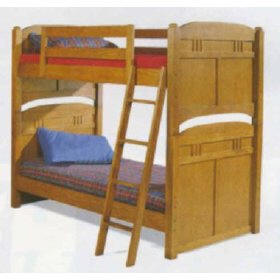
At what (x,y) coordinates should I click in order to perform the action: click on upper head board. Please return your answer as a coordinate pair (x, y). The width and height of the screenshot is (280, 280). Looking at the image, I should click on (23, 29).